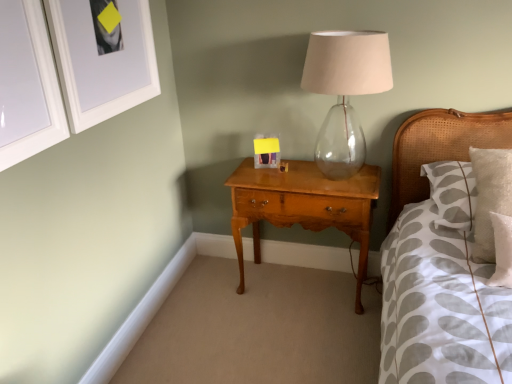
Locate an element on the screen. The width and height of the screenshot is (512, 384). free space that is to the left of shiny brown wood nightstand at center is located at coordinates (215, 303).